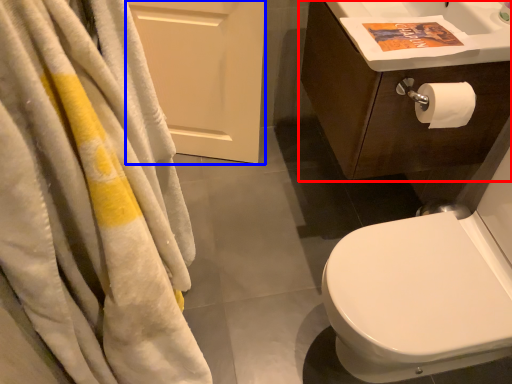
Question: Which point is further to the camera, bathroom cabinet (highlighted by a red box) or screen door (highlighted by a blue box)?

Choices:
 (A) bathroom cabinet
 (B) screen door

Answer: (B)